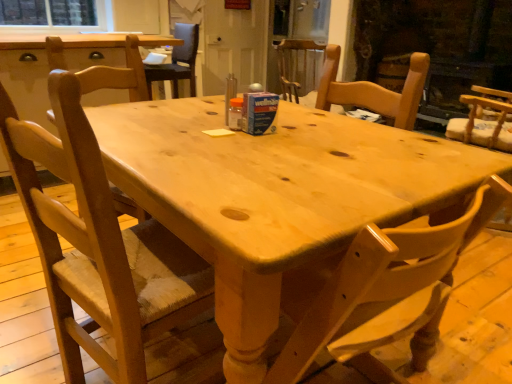
Question: From the image's perspective, is transparent glass screen door at upper center, which is the second screen door in left-to-right order, beneath wooden chair at center, placed as the second chair when sorted from back to front?

Choices:
 (A) no
 (B) yes

Answer: (A)

Question: From the image's perspective, is transparent glass screen door at upper center, which is the second screen door in left-to-right order, over wooden chair at center, placed as the second chair when sorted from back to front?

Choices:
 (A) no
 (B) yes

Answer: (B)

Question: Is transparent glass screen door at upper center, which ranks as the 1th screen door in right-to-left order, facing away from wooden chair at center, which appears as the fourth chair when viewed from the front?

Choices:
 (A) yes
 (B) no

Answer: (B)

Question: Does transparent glass screen door at upper center, which is the second screen door in left-to-right order, appear on the right side of wooden chair at center, the 5th chair in the right-to-left sequence?

Choices:
 (A) no
 (B) yes

Answer: (B)

Question: Is transparent glass screen door at upper center, which is the second screen door in left-to-right order, completely or partially outside of wooden chair at center, placed as the second chair when sorted from back to front?

Choices:
 (A) no
 (B) yes

Answer: (B)

Question: Is light wood chair at center, acting as the 4th chair starting from the left, taller or shorter than transparent glass screen door at upper center, which is the second screen door in left-to-right order?

Choices:
 (A) short
 (B) tall

Answer: (A)

Question: From a real-world perspective, is light wood chair at center, which is the first chair from back to front, physically located above or below transparent glass screen door at upper center, which ranks as the 1th screen door in right-to-left order?

Choices:
 (A) above
 (B) below

Answer: (B)

Question: Is light wood chair at center, which is the second chair from right to left, bigger or smaller than transparent glass screen door at upper center, which is the second screen door in left-to-right order?

Choices:
 (A) small
 (B) big

Answer: (A)

Question: From the image's perspective, relative to transparent glass screen door at upper center, which ranks as the 1th screen door in right-to-left order, is light wood chair at center, which is the first chair from back to front, above or below?

Choices:
 (A) above
 (B) below

Answer: (B)

Question: Is clear glass window screen at upper left wider or thinner than natural wood table at center?

Choices:
 (A) thin
 (B) wide

Answer: (A)

Question: From the image's perspective, is clear glass window screen at upper left above or below natural wood table at center?

Choices:
 (A) above
 (B) below

Answer: (A)

Question: In terms of height, does clear glass window screen at upper left look taller or shorter compared to natural wood table at center?

Choices:
 (A) short
 (B) tall

Answer: (A)

Question: From a real-world perspective, relative to natural wood table at center, is clear glass window screen at upper left vertically above or below?

Choices:
 (A) below
 (B) above

Answer: (B)

Question: Looking at the image, does clear glass window screen at upper left seem bigger or smaller compared to wooden chair at center, the 5th chair in the right-to-left sequence?

Choices:
 (A) big
 (B) small

Answer: (B)

Question: From the image's perspective, is clear glass window screen at upper left located above or below wooden chair at center, placed as the second chair when sorted from back to front?

Choices:
 (A) below
 (B) above

Answer: (B)